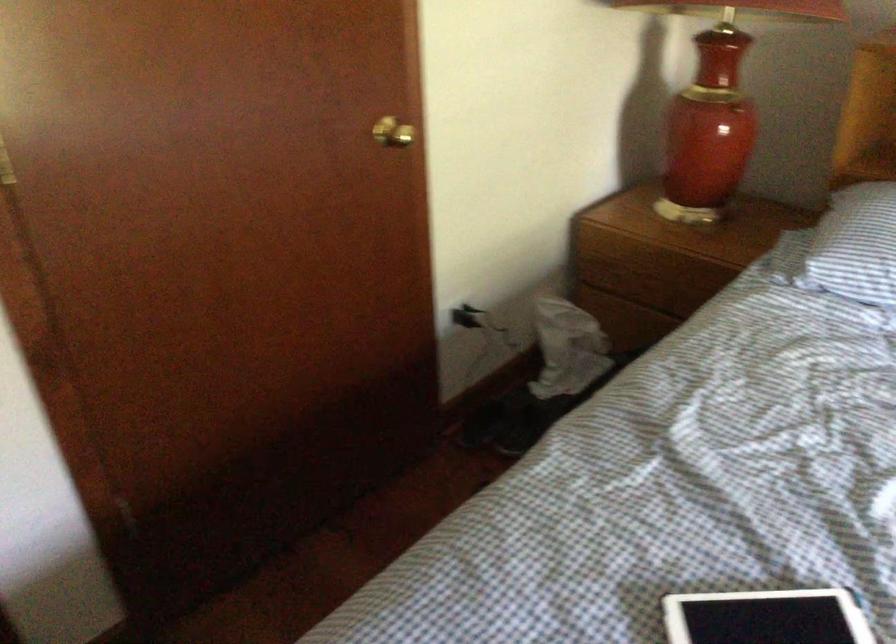
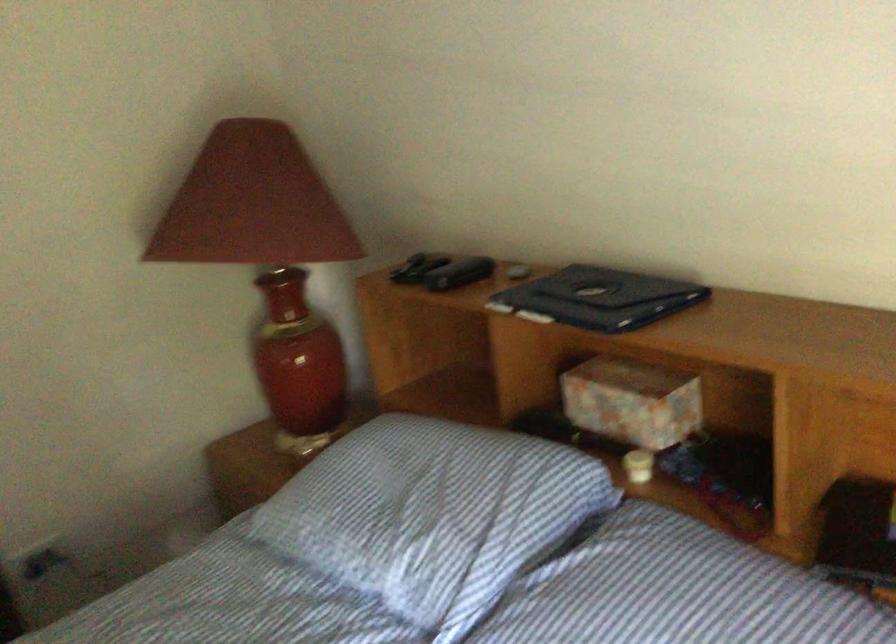
Question: Which direction would the cameraman need to move to produce the second image? Reply with the corresponding letter.

Choices:
 (A) Left
 (B) Right
 (C) Forward
 (D) Backward

Answer: (B)